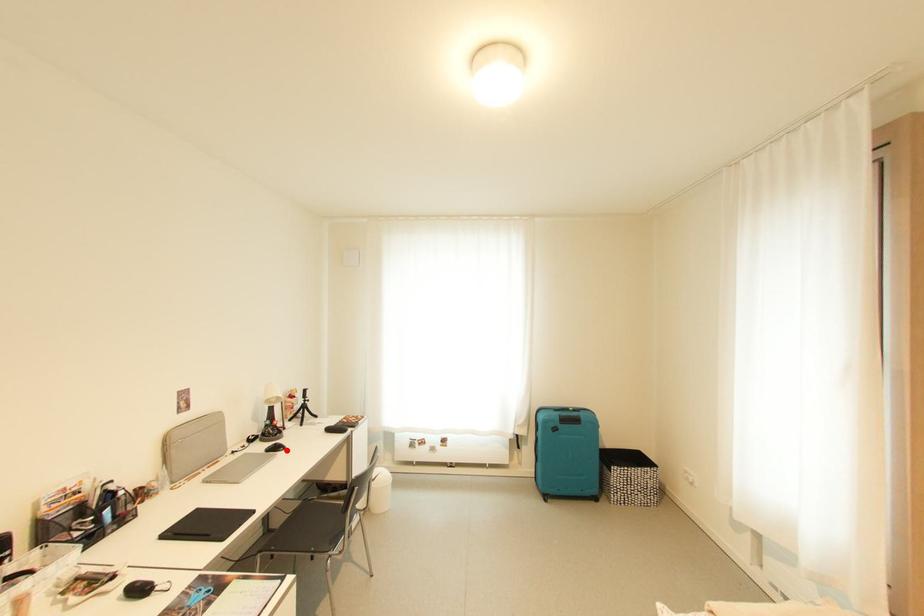
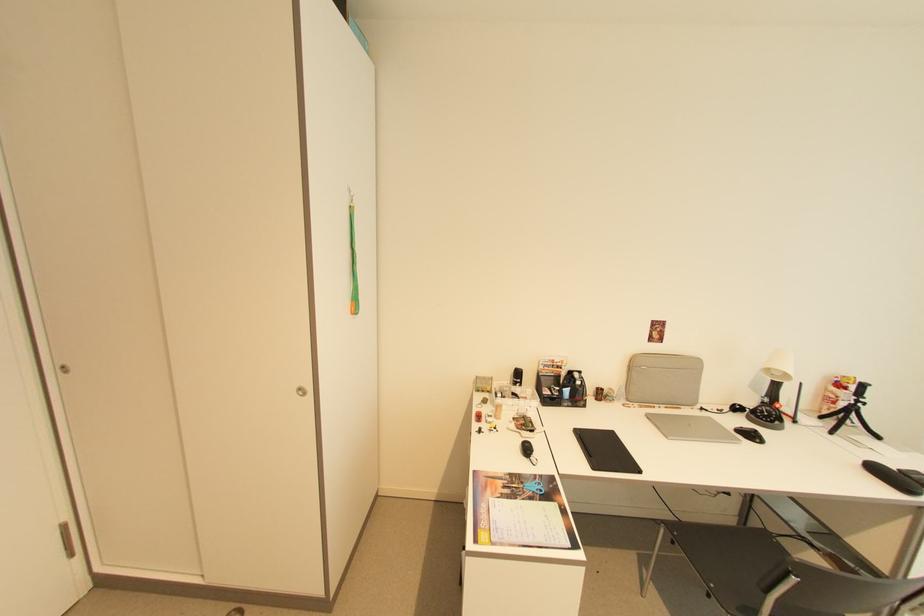
Locate, in the second image, the point that corresponds to the highlighted location in the first image.

(762, 442)